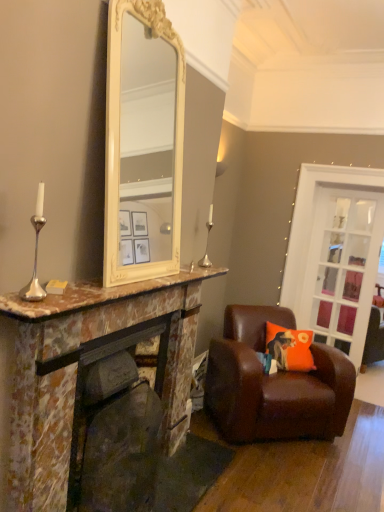
The image size is (384, 512). What are the coordinates of `marble fireplace at left` in the screenshot? It's located at (83, 376).

Image resolution: width=384 pixels, height=512 pixels. What do you see at coordinates (342, 267) in the screenshot? I see `clear glass door at right` at bounding box center [342, 267].

The height and width of the screenshot is (512, 384). What are the coordinates of `brown leather chair at lower right` in the screenshot? It's located at (274, 384).

What do you see at coordinates (290, 348) in the screenshot?
I see `orange fabric cushion at right` at bounding box center [290, 348].

Image resolution: width=384 pixels, height=512 pixels. I want to click on silver/metallic candle holder at center, so click(x=207, y=241).

Is brown leather chair at lower right beside marble fireplace at center?

No, brown leather chair at lower right is not in contact with marble fireplace at center.

Is brown leather chair at lower right oriented towards marble fireplace at center?

No, brown leather chair at lower right does not turn towards marble fireplace at center.

Looking at the image, does brown leather chair at lower right seem bigger or smaller compared to marble fireplace at center?

Clearly, brown leather chair at lower right is larger in size than marble fireplace at center.

Which object is thinner, silver/metallic candle holder at center or orange fabric cushion at right?

With smaller width is silver/metallic candle holder at center.

Is silver/metallic candle holder at center in contact with orange fabric cushion at right?

silver/metallic candle holder at center is not next to orange fabric cushion at right, and they're not touching.

Which of these two, silver/metallic candle holder at center or orange fabric cushion at right, stands taller?

Standing taller between the two is silver/metallic candle holder at center.

Is point (205, 258) positioned behind point (266, 327)?

No, (205, 258) is in front of (266, 327).

Between brown leather chair at lower right and orange fabric cushion at right, which one has larger width?

With larger width is brown leather chair at lower right.

Measure the distance from brown leather chair at lower right to orange fabric cushion at right.

The distance of brown leather chair at lower right from orange fabric cushion at right is 11.09 inches.

From the picture: Is orange fabric cushion at right located within brown leather chair at lower right?

Yes, orange fabric cushion at right is a part of brown leather chair at lower right.

From the image's perspective, is brown leather chair at lower right above or below orange fabric cushion at right?

From the image's perspective, brown leather chair at lower right appears below orange fabric cushion at right.

From their relative heights in the image, would you say marble fireplace at left is taller or shorter than brown leather chair at lower right?

Clearly, marble fireplace at left is taller compared to brown leather chair at lower right.

I want to click on cabinetry in front of the brown leather chair at lower right, so click(83, 376).

From a real-world perspective, is marble fireplace at left above or below brown leather chair at lower right?

marble fireplace at left is above brown leather chair at lower right.

Between silver/metallic candle holder at center and marble fireplace at center, which one has smaller size?

Smaller between the two is silver/metallic candle holder at center.

Considering the positions of point (208, 231) and point (93, 494), is point (208, 231) closer or farther from the camera than point (93, 494)?

Point (208, 231).

Would you consider silver/metallic candle holder at center to be distant from marble fireplace at center?

Yes, silver/metallic candle holder at center and marble fireplace at center are quite far apart.

Image resolution: width=384 pixels, height=512 pixels. Find the location of `candle holder located behind the marble fireplace at center`. candle holder located behind the marble fireplace at center is located at coordinates (207, 241).

Considering the relative sizes of orange fabric cushion at right and marble fireplace at left in the image provided, is orange fabric cushion at right shorter than marble fireplace at left?

Correct, orange fabric cushion at right is not as tall as marble fireplace at left.

Could you tell me if orange fabric cushion at right is facing marble fireplace at left?

Yes, orange fabric cushion at right is aimed at marble fireplace at left.

Is orange fabric cushion at right inside or outside of marble fireplace at left?

orange fabric cushion at right exists outside the volume of marble fireplace at left.

Looking at the image, does clear glass door at right seem bigger or smaller compared to orange fabric cushion at right?

Clearly, clear glass door at right is larger in size than orange fabric cushion at right.

Considering the relative sizes of clear glass door at right and orange fabric cushion at right in the image provided, is clear glass door at right wider than orange fabric cushion at right?

No.

Does clear glass door at right have a lesser height compared to orange fabric cushion at right?

No.

Identify the location of fireplace positioned vertically above the brown leather chair at lower right (from a real-world perspective). The width and height of the screenshot is (384, 512). click(x=116, y=425).

Where is `cushion lying below the silver/metallic candle holder at center (from the image's perspective)`? cushion lying below the silver/metallic candle holder at center (from the image's perspective) is located at coordinates (290, 348).

Estimate the real-world distances between objects in this image. Which object is further from marble fireplace at left, marble fireplace at center or silver/metallic candle holder at center?

silver/metallic candle holder at center is positioned further to the anchor marble fireplace at left.

Based on their spatial positions, is marble fireplace at left or marble fireplace at center further from orange fabric cushion at right?

marble fireplace at center lies further to orange fabric cushion at right than the other object.

Estimate the real-world distances between objects in this image. Which object is further from marble fireplace at center, orange fabric cushion at right or marble fireplace at left?

orange fabric cushion at right.

Consider the image. Based on their spatial positions, is marble fireplace at center or orange fabric cushion at right further from marble fireplace at left?

Among the two, orange fabric cushion at right is located further to marble fireplace at left.

Which object lies further to the anchor point silver/metallic candle holder at center, orange fabric cushion at right or marble fireplace at center?

marble fireplace at center.

When comparing their distances from clear glass door at right, does brown leather chair at lower right or orange fabric cushion at right seem closer?

orange fabric cushion at right is closer to clear glass door at right.

From the image, which object appears to be farther from orange fabric cushion at right, brown leather chair at lower right or silver/metallic candle holder at center?

The object further to orange fabric cushion at right is silver/metallic candle holder at center.

Considering their positions, is orange fabric cushion at right positioned further to brown leather chair at lower right than marble fireplace at left?

The object further to brown leather chair at lower right is marble fireplace at left.

Where is `fireplace located between marble fireplace at left and silver/metallic candle holder at center in the depth direction`? The image size is (384, 512). fireplace located between marble fireplace at left and silver/metallic candle holder at center in the depth direction is located at coordinates (116, 425).

I want to click on fireplace between marble fireplace at left and brown leather chair at lower right from front to back, so click(116, 425).

Find the location of a particular element. candle holder between marble fireplace at left and orange fabric cushion at right from front to back is located at coordinates (207, 241).

Identify the location of chair between marble fireplace at left and orange fabric cushion at right along the z-axis. (274, 384).